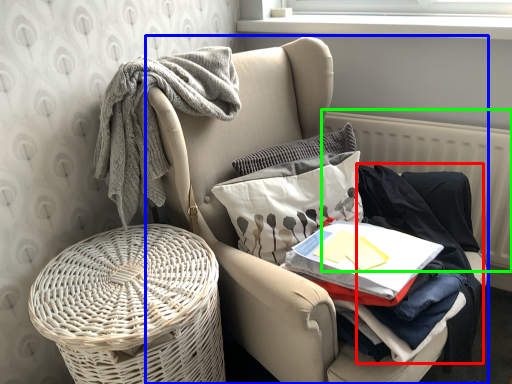
Question: Estimate the real-world distances between objects in this image. Which object is closer to clothing (highlighted by a red box), chair (highlighted by a blue box) or radiator (highlighted by a green box)?

Choices:
 (A) chair
 (B) radiator

Answer: (B)